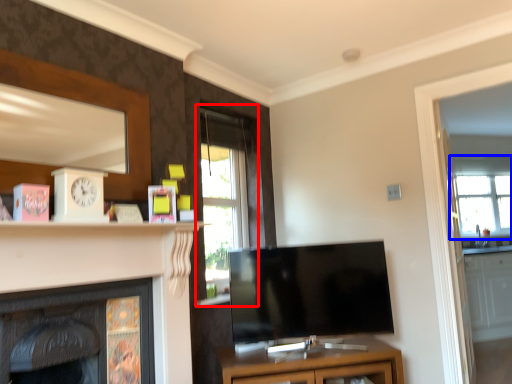
Question: Which of the following is the closest to the observer, window (highlighted by a red box) or window (highlighted by a blue box)?

Choices:
 (A) window
 (B) window

Answer: (A)